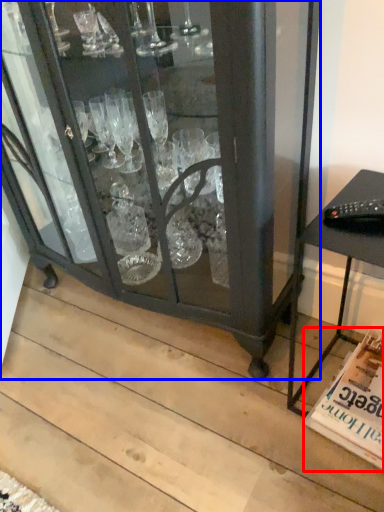
Question: Which of the following is the farthest to the observer, magazine (highlighted by a red box) or furniture (highlighted by a blue box)?

Choices:
 (A) magazine
 (B) furniture

Answer: (A)